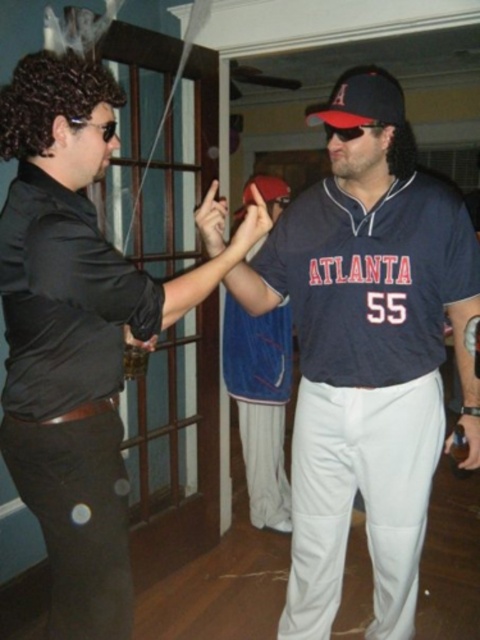
What are the coordinates of the dark blue fabric baseball cap at center?

The dark blue fabric baseball cap at center is located at coordinates (360, 100).

You are organizing a baseball cap display and need to arrange the dark blue fabric baseball cap at center and the red matte baseball cap at center side by side. Which cap should be placed on the left to ensure they fit within a 1.2 meter shelf?

The dark blue fabric baseball cap at center has a lesser width compared to the red matte baseball cap at center. To fit both on a 1.2 meter shelf, place the wider red matte baseball cap at center on the left and the narrower dark blue fabric baseball cap at center on the right, ensuring they fit within the space.